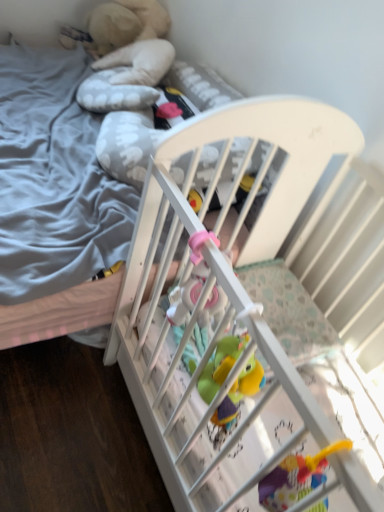
Image resolution: width=384 pixels, height=512 pixels. What do you see at coordinates (192, 279) in the screenshot?
I see `pink rubber toy at center` at bounding box center [192, 279].

I want to click on pink rubber toy at center, so click(192, 279).

What is the approximate height of pink rubber toy at center?

The height of pink rubber toy at center is 10.39 inches.

You are a GUI agent. You are given a task and a screenshot of the screen. Output one action in this format:
    pyautogui.click(x=<x>, y=<y>)
    Task: Click on the white wooden crib at center
    The image size is (384, 512).
    Given the screenshot: What is the action you would take?
    pyautogui.click(x=238, y=333)

What do you see at coordinates (238, 333) in the screenshot?
I see `white wooden crib at center` at bounding box center [238, 333].

Locate an element on the screen. The width and height of the screenshot is (384, 512). pink rubber toy at center is located at coordinates (192, 279).

Considering the relative positions of pink rubber toy at center and white wooden crib at center in the image provided, is pink rubber toy at center to the right of white wooden crib at center from the viewer's perspective?

Correct, you'll find pink rubber toy at center to the right of white wooden crib at center.

Is pink rubber toy at center positioned behind white wooden crib at center?

No, pink rubber toy at center is in front of white wooden crib at center.

Does point (178, 287) lie behind point (213, 245)?

Yes, it is behind point (213, 245).

From the image's perspective, is pink rubber toy at center above or below white wooden crib at center?

pink rubber toy at center is situated higher than white wooden crib at center in the image.

From a real-world perspective, is pink rubber toy at center positioned over white wooden crib at center based on gravity?

Yes, from a real-world perspective, pink rubber toy at center is on top of white wooden crib at center.

Considering the sizes of objects pink rubber toy at center and white wooden crib at center in the image provided, who is thinner, pink rubber toy at center or white wooden crib at center?

Thinner between the two is pink rubber toy at center.

From their relative heights in the image, would you say pink rubber toy at center is taller or shorter than white wooden crib at center?

In the image, pink rubber toy at center appears to be taller than white wooden crib at center.

Based on their sizes in the image, would you say pink rubber toy at center is bigger or smaller than white wooden crib at center?

Considering their sizes, pink rubber toy at center takes up less space than white wooden crib at center.

In the scene shown: Is pink rubber toy at center surrounding white wooden crib at center?

No, white wooden crib at center is located outside of pink rubber toy at center.

Does pink rubber toy at center touch white wooden crib at center?

No.

Is pink rubber toy at center turned away from white wooden crib at center?

pink rubber toy at center does not have its back to white wooden crib at center.

From the picture: What's the angular difference between pink rubber toy at center and white wooden crib at center's facing directions?

89.9 degrees separate the facing orientations of pink rubber toy at center and white wooden crib at center.

Measure the distance between pink rubber toy at center and white wooden crib at center.

pink rubber toy at center and white wooden crib at center are 10.69 inches apart.

At what (x,y) coordinates should I click in order to perform the action: click on toy in front of the white wooden crib at center. Please return your answer as a coordinate pair (x, y). This screenshot has height=512, width=384. Looking at the image, I should click on (192, 279).

Does white wooden crib at center appear on the left side of pink rubber toy at center?

Correct, you'll find white wooden crib at center to the left of pink rubber toy at center.

Is white wooden crib at center in front of or behind pink rubber toy at center in the image?

Clearly, white wooden crib at center is behind pink rubber toy at center.

Does point (258, 332) appear closer or farther from the camera than point (201, 317)?

Point (258, 332) appears to be closer to the viewer than point (201, 317).

From the image's perspective, is white wooden crib at center below pink rubber toy at center?

Yes, from the image's perspective, white wooden crib at center is below pink rubber toy at center.

From a real-world perspective, which is physically above, white wooden crib at center or pink rubber toy at center?

pink rubber toy at center is physically above.

Considering the sizes of white wooden crib at center and pink rubber toy at center in the image, is white wooden crib at center wider or thinner than pink rubber toy at center?

white wooden crib at center is wider than pink rubber toy at center.

Considering the sizes of objects white wooden crib at center and pink rubber toy at center in the image provided, who is shorter, white wooden crib at center or pink rubber toy at center?

With less height is white wooden crib at center.

Considering the sizes of objects white wooden crib at center and pink rubber toy at center in the image provided, who is smaller, white wooden crib at center or pink rubber toy at center?

pink rubber toy at center.

Can we say white wooden crib at center lies outside pink rubber toy at center?

Yes.

Is the surface of white wooden crib at center in direct contact with pink rubber toy at center?

No, white wooden crib at center is not beside pink rubber toy at center.

Could you tell me if white wooden crib at center is facing pink rubber toy at center?

No, white wooden crib at center is not oriented towards pink rubber toy at center.

Find the location of a particular element. This screenshot has height=512, width=384. toy located in front of the white wooden crib at center is located at coordinates (192, 279).

In order to click on toy lying in front of the white wooden crib at center in this screenshot , I will do `click(192, 279)`.

You are a GUI agent. You are given a task and a screenshot of the screen. Output one action in this format:
    pyautogui.click(x=<x>, y=<y>)
    Task: Click on the toy on the right of white wooden crib at center
    This screenshot has width=384, height=512.
    Given the screenshot: What is the action you would take?
    point(192,279)